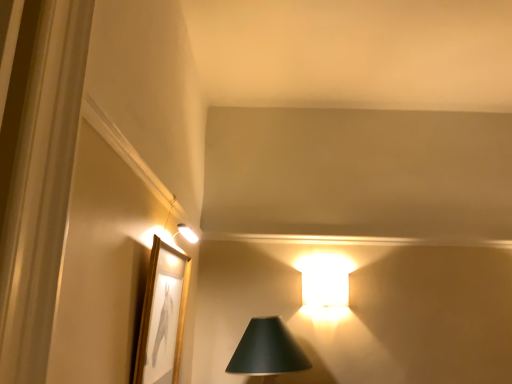
Question: Is gold/glossy picture frame at upper left taller or shorter than matte black lampshade at lower center?

Choices:
 (A) short
 (B) tall

Answer: (B)

Question: Is gold/glossy picture frame at upper left in front of or behind matte black lampshade at lower center in the image?

Choices:
 (A) behind
 (B) front

Answer: (B)

Question: Considering the positions of point pos(158,258) and point pos(308,360), is point pos(158,258) closer or farther from the camera than point pos(308,360)?

Choices:
 (A) farther
 (B) closer

Answer: (B)

Question: Considering the positions of matte black lampshade at lower center and gold/glossy picture frame at upper left in the image, is matte black lampshade at lower center bigger or smaller than gold/glossy picture frame at upper left?

Choices:
 (A) small
 (B) big

Answer: (B)

Question: Considering the positions of matte black lampshade at lower center and gold/glossy picture frame at upper left in the image, is matte black lampshade at lower center taller or shorter than gold/glossy picture frame at upper left?

Choices:
 (A) short
 (B) tall

Answer: (A)

Question: Do you think matte black lampshade at lower center is within gold/glossy picture frame at upper left, or outside of it?

Choices:
 (A) inside
 (B) outside

Answer: (B)

Question: From the image's perspective, is matte black lampshade at lower center above or below gold/glossy picture frame at upper left?

Choices:
 (A) above
 (B) below

Answer: (B)